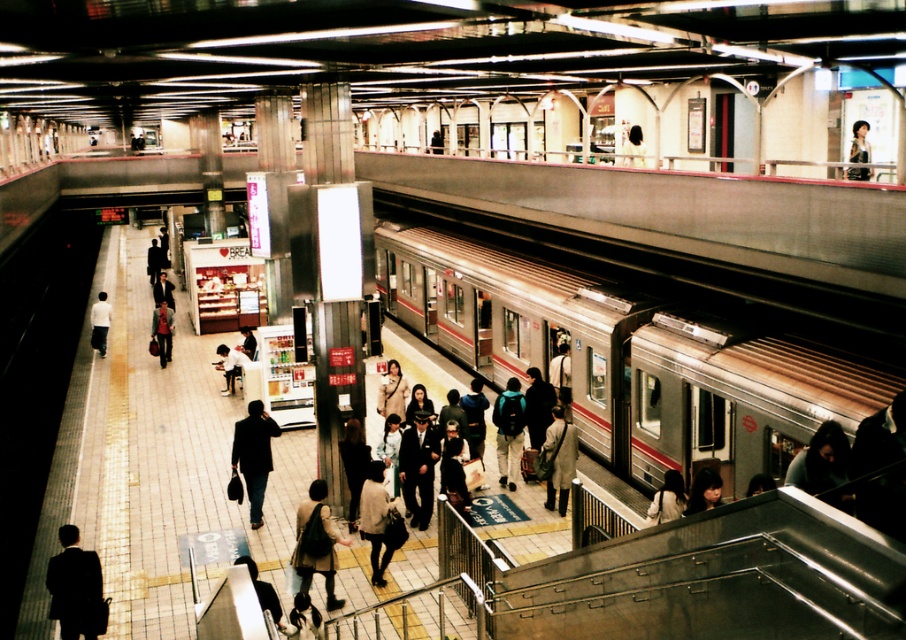
Between matte black jacket at lower center and matte black suit at center, which one is positioned lower?

Positioned lower is matte black jacket at lower center.

What do you see at coordinates (667, 499) in the screenshot? Image resolution: width=906 pixels, height=640 pixels. I see `matte black jacket at lower center` at bounding box center [667, 499].

I want to click on matte black jacket at lower center, so click(667, 499).

Based on the photo, who is higher up, silver metallic train at center or dark gray uniform at center?

silver metallic train at center

Can you confirm if silver metallic train at center is positioned below dark gray uniform at center?

Incorrect, silver metallic train at center is not positioned below dark gray uniform at center.

At what (x,y) coordinates should I click in order to perform the action: click on silver metallic train at center. Please return your answer as a coordinate pair (x, y). The image size is (906, 640). Looking at the image, I should click on (625, 360).

Is silhouette suit at center closer to camera compared to matte black jacket at left?

Yes, silhouette suit at center is closer to the viewer.

Describe the element at coordinates (254, 454) in the screenshot. I see `silhouette suit at center` at that location.

This screenshot has width=906, height=640. I want to click on silhouette suit at center, so click(x=254, y=454).